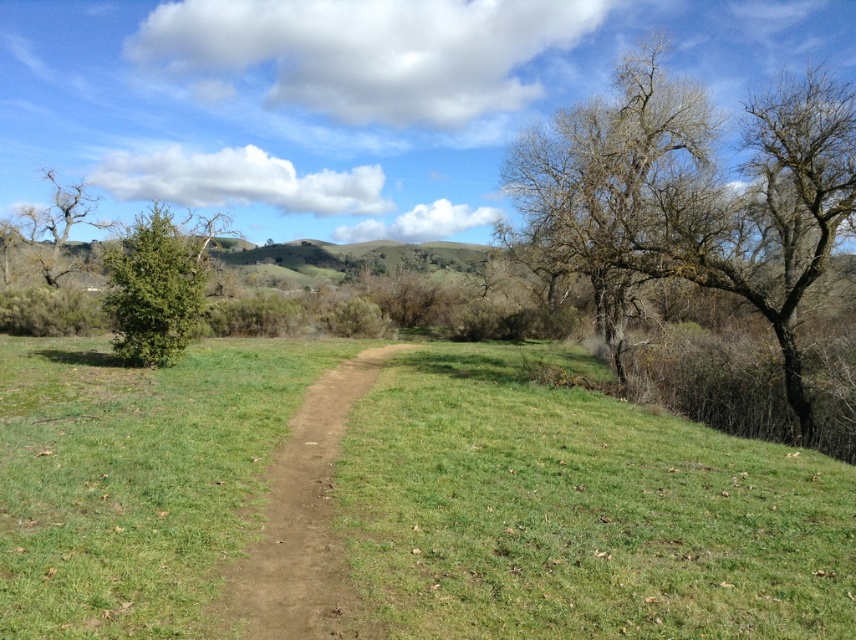
Question: Can you confirm if brown dirt track at center is positioned to the left of green matte tree at left?

Choices:
 (A) no
 (B) yes

Answer: (A)

Question: Can you confirm if bare branches at upper right is bigger than bare branches at upper left?

Choices:
 (A) no
 (B) yes

Answer: (A)

Question: Based on their relative distances, which object is farther from the bare branches at upper right?

Choices:
 (A) brown dirt track at center
 (B) bare branches at upper left
 (C) green matte tree at left

Answer: (B)

Question: Which object is positioned farthest from the bare branches at upper left?

Choices:
 (A) green matte tree at left
 (B) brown dirt track at center
 (C) bare branches at upper right

Answer: (B)

Question: Which is farther from the brown dirt track at center?

Choices:
 (A) bare branches at upper right
 (B) green matte tree at left
 (C) bare branches at upper left

Answer: (C)

Question: Is bare branches at upper right bigger than bare branches at upper left?

Choices:
 (A) no
 (B) yes

Answer: (A)